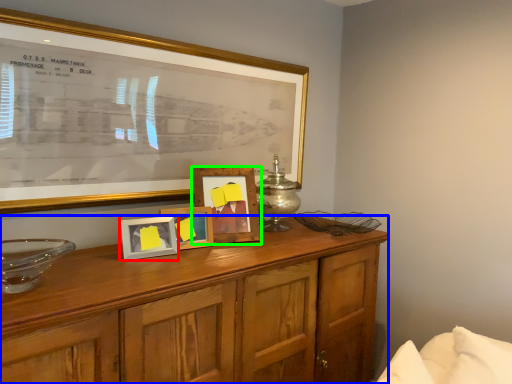
Question: Estimate the real-world distances between objects in this image. Which object is closer to picture frame (highlighted by a red box), cabinetry (highlighted by a blue box) or picture frame (highlighted by a green box)?

Choices:
 (A) cabinetry
 (B) picture frame

Answer: (B)